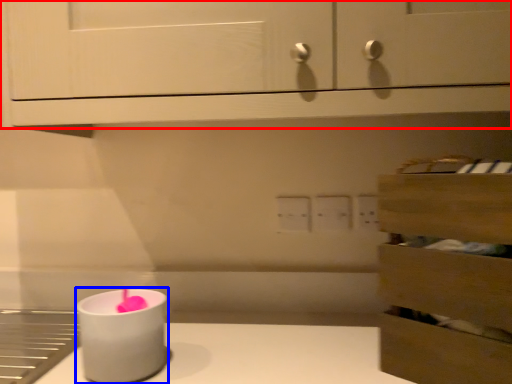
Question: Among these objects, which one is nearest to the camera, cabinetry (highlighted by a red box) or candle holder (highlighted by a blue box)?

Choices:
 (A) cabinetry
 (B) candle holder

Answer: (A)